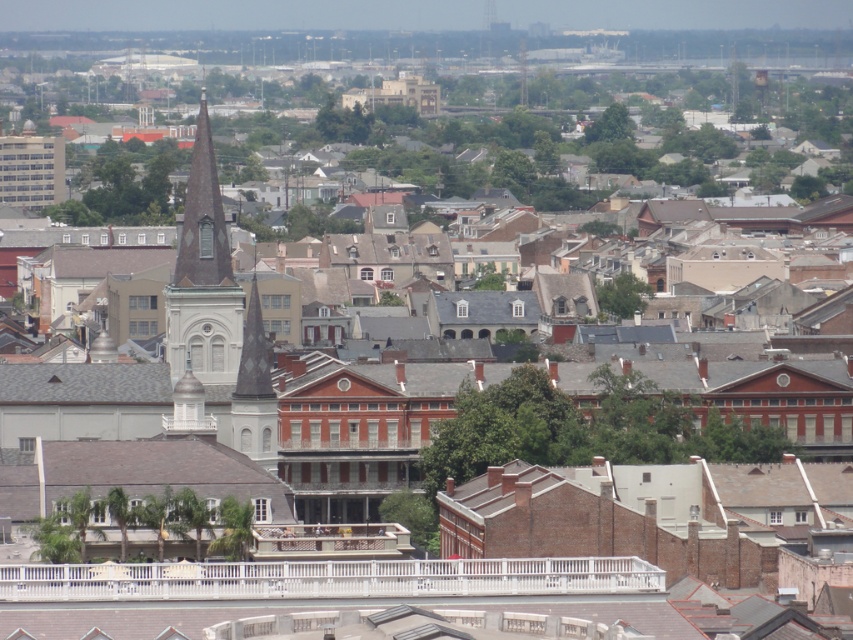
Which is below, smooth gray steeple at center or white stone spire at center-left?

white stone spire at center-left

Is point (229, 305) positioned after point (271, 461)?

Yes, point (229, 305) is farther from viewer.

Identify the location of smooth gray steeple at center. This screenshot has height=640, width=853. (202, 276).